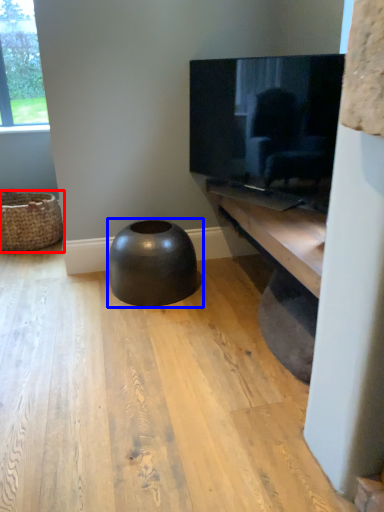
Question: Which object is further to the camera taking this photo, basket (highlighted by a red box) or stool (highlighted by a blue box)?

Choices:
 (A) basket
 (B) stool

Answer: (A)